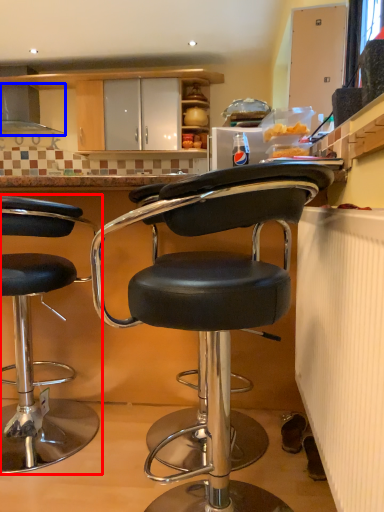
Question: Which object is closer to the camera taking this photo, chair (highlighted by a red box) or exhaust hood (highlighted by a blue box)?

Choices:
 (A) chair
 (B) exhaust hood

Answer: (A)